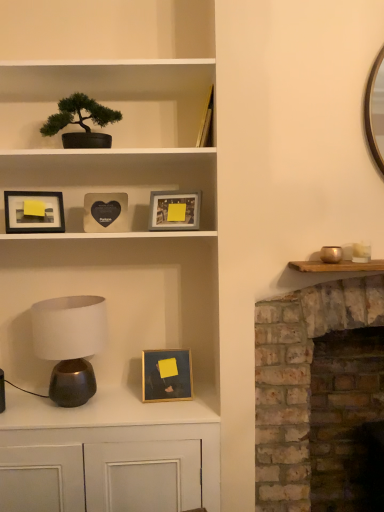
At what (x,y) coordinates should I click in order to perform the action: click on blank area beneath satin white lampshade at lower left (from a real-world perspective). Please return your answer as a coordinate pair (x, y). Looking at the image, I should click on (72, 409).